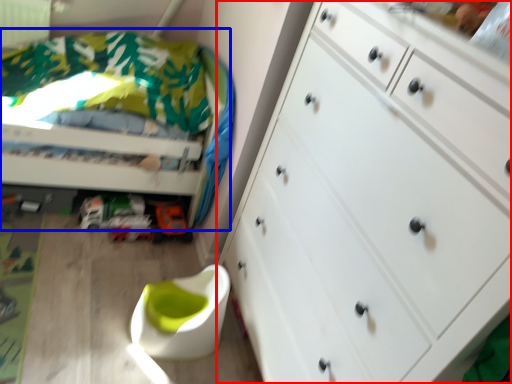
Question: Which point is further to the camera, chest of drawers (highlighted by a red box) or bed (highlighted by a blue box)?

Choices:
 (A) chest of drawers
 (B) bed

Answer: (B)